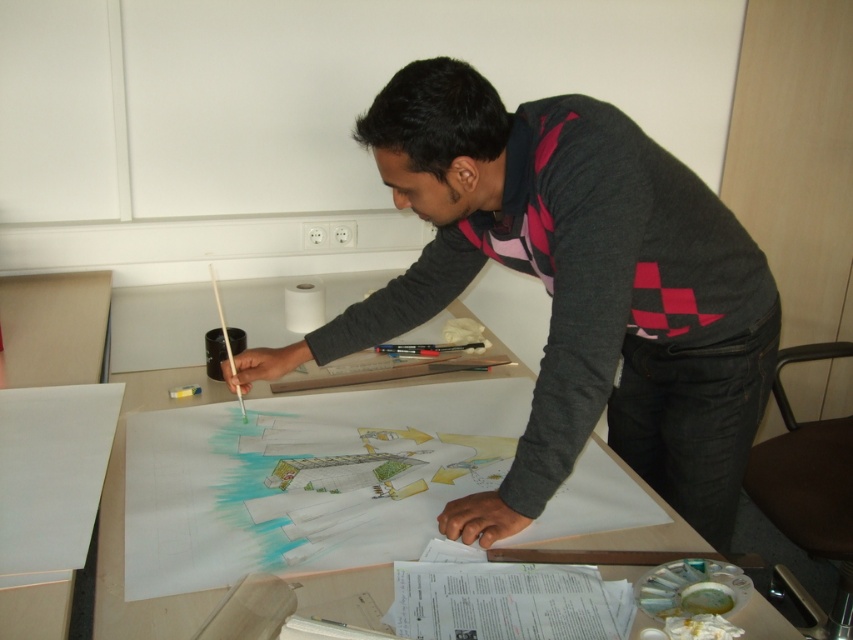
You are a photographer trying to capture a closeup of the person working on the desk. You want to focus on the area closest to you between the two points labeled point (x=132, y=387) and point (x=305, y=316). Which point should you aim your camera at?

Point (x=132, y=387) is closer to the viewer than point (x=305, y=316), so you should aim your camera at point (x=132, y=387) to capture the closest area.

You are an art student who needs to choose between the white paper at center and the white matte paper at center for a project. Which one should you pick if you want the larger size?

The white paper at center has a larger size compared to the white matte paper at center, so you should choose the white paper at center for your project.

You are standing in front of the desk and want to reach both the point at (583, 451) and the point at (177, 627). Which point will you touch first?

The point at (583, 451) is closer to you than the point at (177, 627), so you will touch the point at (583, 451) first.